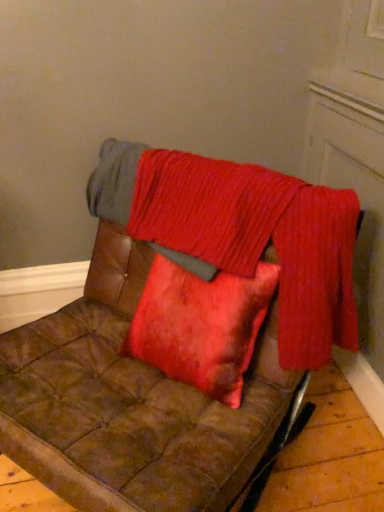
Question: From a real-world perspective, relative to brown leather chair at center, is crinkled red fabric at upper center vertically above or below?

Choices:
 (A) above
 (B) below

Answer: (A)

Question: Considering the positions of point (355, 220) and point (274, 300), is point (355, 220) closer or farther from the camera than point (274, 300)?

Choices:
 (A) closer
 (B) farther

Answer: (B)

Question: Would you say crinkled red fabric at upper center is to the left or to the right of brown leather chair at center in the picture?

Choices:
 (A) right
 (B) left

Answer: (A)

Question: Is brown leather chair at center in front of or behind crinkled red fabric at upper center in the image?

Choices:
 (A) front
 (B) behind

Answer: (A)

Question: Is point click(8, 343) closer or farther from the camera than point click(261, 178)?

Choices:
 (A) farther
 (B) closer

Answer: (A)

Question: In terms of size, does brown leather chair at center appear bigger or smaller than crinkled red fabric at upper center?

Choices:
 (A) small
 (B) big

Answer: (B)

Question: From their relative heights in the image, would you say brown leather chair at center is taller or shorter than crinkled red fabric at upper center?

Choices:
 (A) tall
 (B) short

Answer: (A)